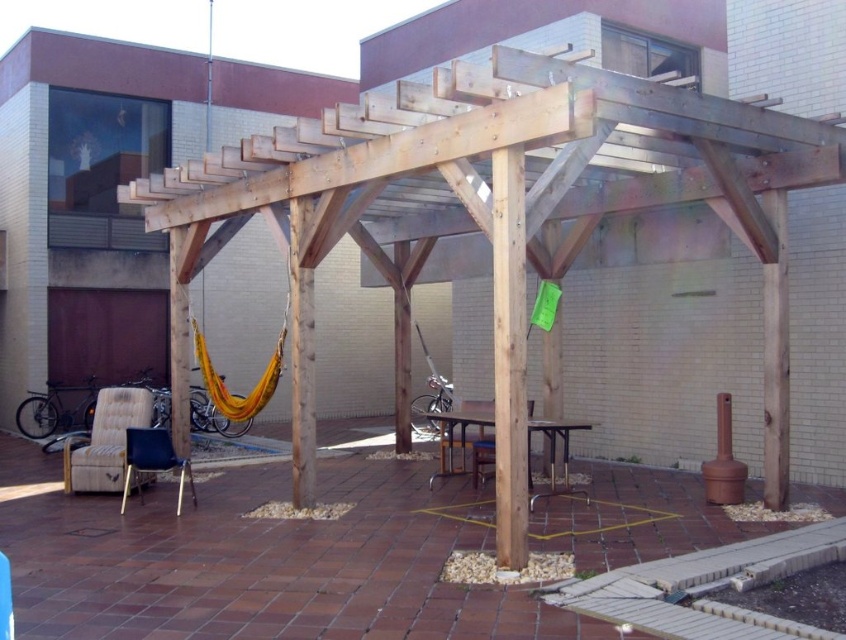
Question: Considering the real-world distances, which object is farthest from the beige fabric chair at lower left?

Choices:
 (A) metallic gray chair at lower left
 (B) wooden chair at center

Answer: (B)

Question: Which object is positioned farthest from the beige fabric chair at lower left?

Choices:
 (A) wooden chair at center
 (B) metallic gray chair at lower left

Answer: (A)

Question: Does beige fabric chair at lower left appear on the left side of wooden chair at center?

Choices:
 (A) yes
 (B) no

Answer: (A)

Question: Which is nearer to the beige fabric chair at lower left?

Choices:
 (A) metallic gray chair at lower left
 (B) wooden chair at center

Answer: (A)

Question: Is beige fabric chair at lower left positioned at the back of wooden chair at center?

Choices:
 (A) no
 (B) yes

Answer: (B)

Question: Can you confirm if beige fabric chair at lower left is bigger than metallic gray chair at lower left?

Choices:
 (A) yes
 (B) no

Answer: (A)